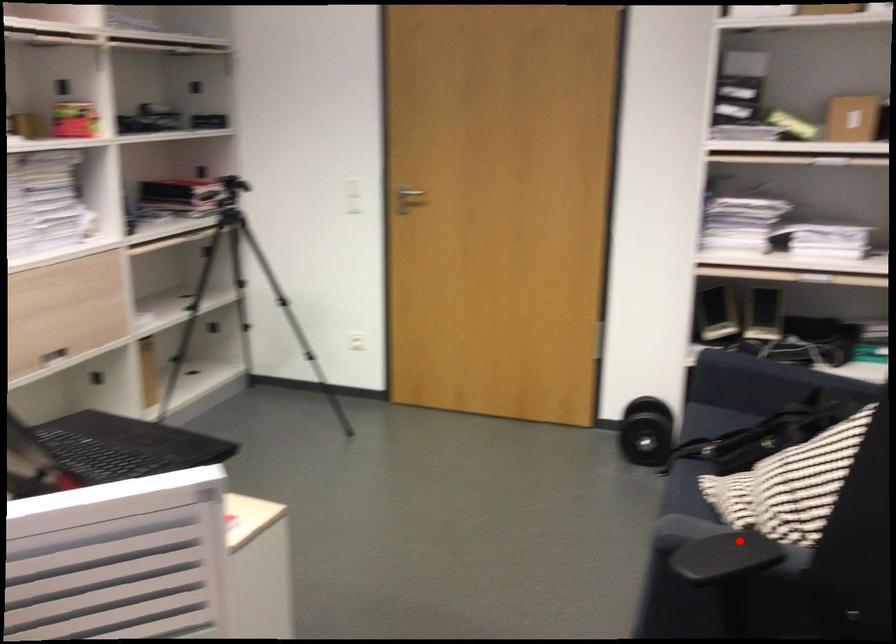
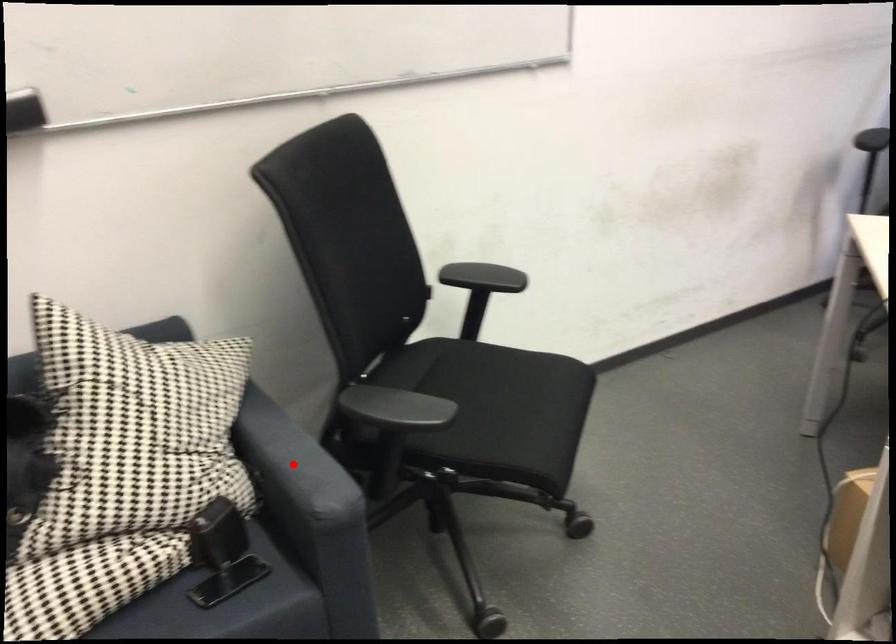
I am providing you with two images of the same scene from different viewpoints. A red point is marked on the first image and another point is marked on the second image. Is the marked point in image1 the same physical position as the marked point in image2?

Yes